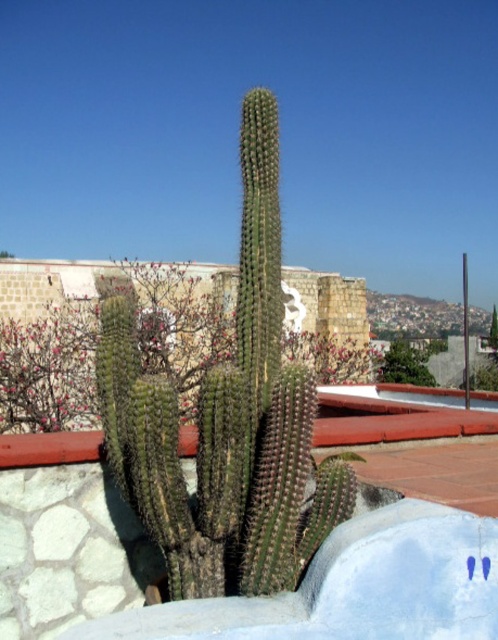
Question: Is green spiny cactus at center above green spiky cactus at center?

Choices:
 (A) no
 (B) yes

Answer: (B)

Question: Can you confirm if green spiny cactus at center is positioned to the left of green spiky cactus at center?

Choices:
 (A) yes
 (B) no

Answer: (A)

Question: Which point is closer to the camera?

Choices:
 (A) green spiky cactus at center
 (B) green spiny cactus at center

Answer: (B)

Question: Does green spiny cactus at center have a larger size compared to green spiky cactus at center?

Choices:
 (A) no
 (B) yes

Answer: (A)